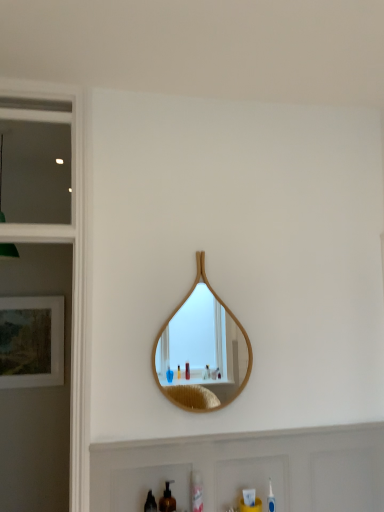
Question: Can you confirm if clear glass window at upper left is positioned to the right of matte wooden picture frame at left?

Choices:
 (A) no
 (B) yes

Answer: (B)

Question: Considering the relative sizes of clear glass window at upper left and matte wooden picture frame at left in the image provided, is clear glass window at upper left shorter than matte wooden picture frame at left?

Choices:
 (A) no
 (B) yes

Answer: (A)

Question: Could you tell me if clear glass window at upper left is facing matte wooden picture frame at left?

Choices:
 (A) no
 (B) yes

Answer: (A)

Question: Is clear glass window at upper left positioned beyond the bounds of matte wooden picture frame at left?

Choices:
 (A) yes
 (B) no

Answer: (A)

Question: Would you consider clear glass window at upper left to be distant from matte wooden picture frame at left?

Choices:
 (A) no
 (B) yes

Answer: (B)

Question: Is clear plastic mouthwash at lower center, marked as the second mouthwash in a front-to-back arrangement, inside the boundaries of clear glass window at upper left, or outside?

Choices:
 (A) outside
 (B) inside

Answer: (A)

Question: Based on their positions, is clear plastic mouthwash at lower center, placed as the second mouthwash when sorted from left to right, located to the left or right of clear glass window at upper left?

Choices:
 (A) left
 (B) right

Answer: (B)

Question: Does point (195, 488) appear closer or farther from the camera than point (61, 112)?

Choices:
 (A) farther
 (B) closer

Answer: (B)

Question: Relative to clear glass window at upper left, is clear plastic mouthwash at lower center, which is counted as the first mouthwash, starting from the back, in front or behind?

Choices:
 (A) behind
 (B) front

Answer: (B)

Question: Is brown matte soap dispenser at lower center to the left or to the right of matte wooden picture frame at left in the image?

Choices:
 (A) left
 (B) right

Answer: (B)

Question: Based on their sizes in the image, would you say brown matte soap dispenser at lower center is bigger or smaller than matte wooden picture frame at left?

Choices:
 (A) small
 (B) big

Answer: (A)

Question: Is brown matte soap dispenser at lower center spatially inside matte wooden picture frame at left, or outside of it?

Choices:
 (A) outside
 (B) inside

Answer: (A)

Question: Is brown matte soap dispenser at lower center in front of or behind matte wooden picture frame at left in the image?

Choices:
 (A) front
 (B) behind

Answer: (A)

Question: Considering their positions, is wooden mirror at center located in front of or behind brown matte soap dispenser at lower center?

Choices:
 (A) behind
 (B) front

Answer: (A)

Question: In terms of size, does wooden mirror at center appear bigger or smaller than brown matte soap dispenser at lower center?

Choices:
 (A) small
 (B) big

Answer: (B)